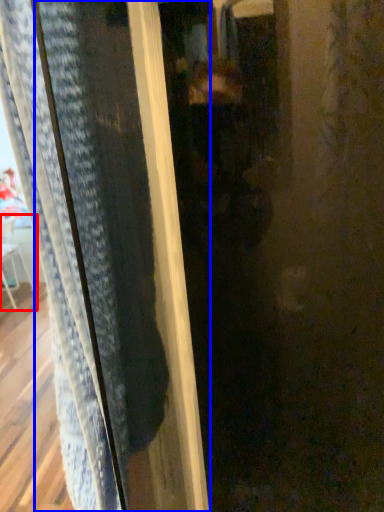
Question: Which of the following is the farthest to the observer, armchair (highlighted by a red box) or screen door (highlighted by a blue box)?

Choices:
 (A) armchair
 (B) screen door

Answer: (A)